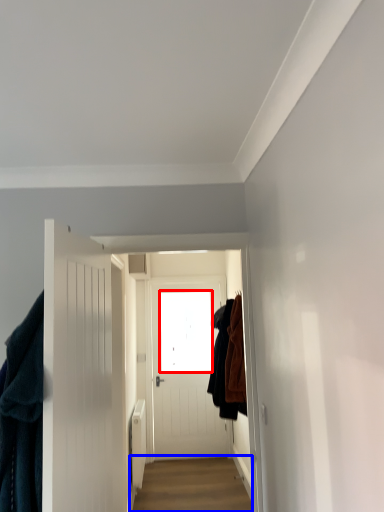
Question: Which point is further to the camera, window screen (highlighted by a red box) or alley (highlighted by a blue box)?

Choices:
 (A) window screen
 (B) alley

Answer: (A)